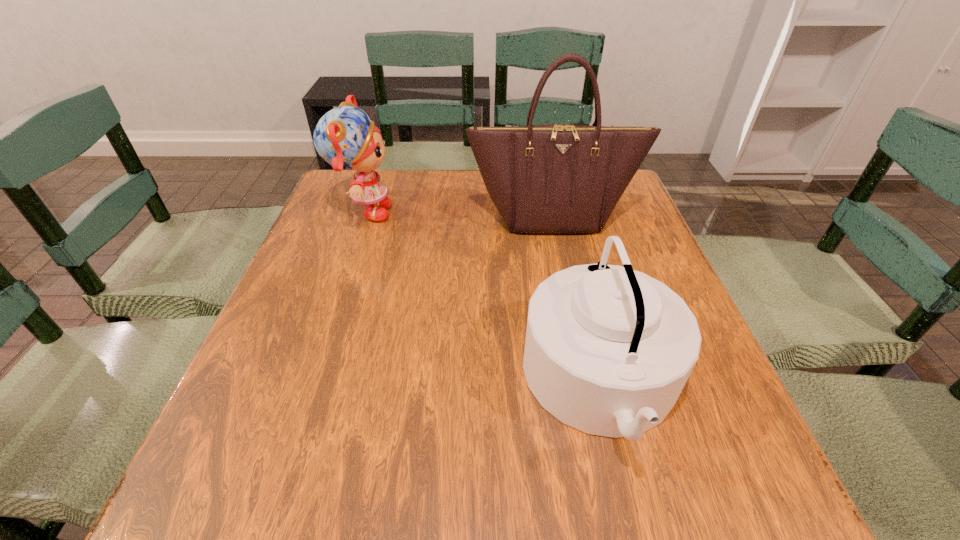
Locate an element on the screen. The image size is (960, 540). vacant space at the far left corner of the desktop is located at coordinates pyautogui.click(x=326, y=212).

You are a GUI agent. You are given a task and a screenshot of the screen. Output one action in this format:
    pyautogui.click(x=<x>, y=<y>)
    Task: Click on the free space at the near left corner
    
    Given the screenshot: What is the action you would take?
    pyautogui.click(x=236, y=480)

Find the location of a particular element. free space between the nearest object and the doll is located at coordinates (483, 299).

Locate an element on the screen. This screenshot has height=540, width=960. blank region between the nearest object and the doll is located at coordinates (483, 299).

Identify the location of vacant point located between the tallest object and the doll. Image resolution: width=960 pixels, height=540 pixels. (458, 215).

You are a GUI agent. You are given a task and a screenshot of the screen. Output one action in this format:
    pyautogui.click(x=<x>, y=<y>)
    Task: Click on the empty space that is in between the handbag and the leftmost object
    Image resolution: width=960 pixels, height=540 pixels.
    Given the screenshot: What is the action you would take?
    pyautogui.click(x=458, y=215)

Image resolution: width=960 pixels, height=540 pixels. In order to click on free space between the kettle and the doll in this screenshot , I will do `click(483, 299)`.

What are the coordinates of `empty space between the leftmost object and the handbag` in the screenshot? It's located at (458, 215).

In order to click on free space between the doll and the kettle in this screenshot , I will do `click(483, 299)`.

Locate an element on the screen. This screenshot has height=540, width=960. free point between the doll and the tallest object is located at coordinates click(458, 215).